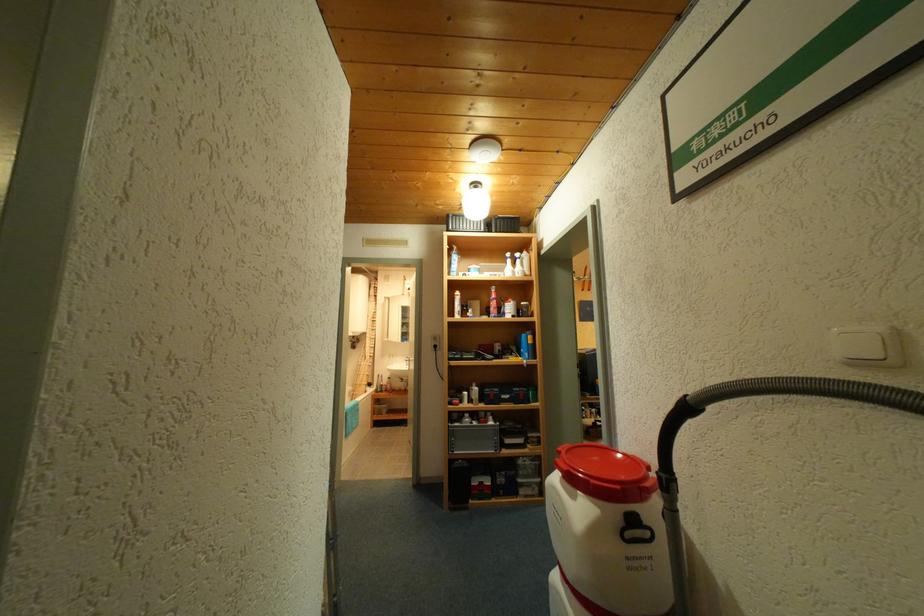
Describe the element at coordinates (387, 385) in the screenshot. This screenshot has height=616, width=924. I see `the silver appliance knob` at that location.